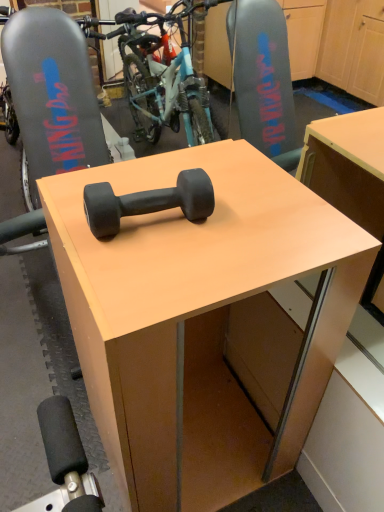
Measure the distance between point (201,176) and camera.

30.04 inches.

What is the approximate width of black rubber dumbbell at center?

black rubber dumbbell at center is 9.39 inches wide.

I want to click on black rubber dumbbell at center, so click(148, 202).

In order to face black rubber dumbbell at center, should I rotate leftwards or rightwards?

Turn left approximately 6.451 degrees to face it.

This screenshot has height=512, width=384. What do you see at coordinates (148, 202) in the screenshot?
I see `black rubber dumbbell at center` at bounding box center [148, 202].

Looking at this image, what is the approximate width of matte black dumbbell at center?

The width of matte black dumbbell at center is 52.52 centimeters.

You are a GUI agent. You are given a task and a screenshot of the screen. Output one action in this format:
    pyautogui.click(x=<x>, y=<y>)
    Task: Click on the matte black dumbbell at center
    The image size is (384, 512).
    Given the screenshot: What is the action you would take?
    pyautogui.click(x=198, y=319)

The height and width of the screenshot is (512, 384). Describe the element at coordinates (198, 319) in the screenshot. I see `matte black dumbbell at center` at that location.

You are a GUI agent. You are given a task and a screenshot of the screen. Output one action in this format:
    pyautogui.click(x=<x>, y=<y>)
    Task: Click on the black rubber dumbbell at center
    
    Given the screenshot: What is the action you would take?
    pyautogui.click(x=148, y=202)

Would you say black rubber dumbbell at center is to the left or to the right of matte black dumbbell at center in the picture?

black rubber dumbbell at center is positioned on matte black dumbbell at center's left side.

Which is behind, black rubber dumbbell at center or matte black dumbbell at center?

black rubber dumbbell at center is more distant.

Which is farther from the camera, (98, 192) or (203, 302)?

Positioned behind is point (98, 192).

From the image's perspective, is black rubber dumbbell at center located beneath matte black dumbbell at center?

Incorrect, from the image's perspective, black rubber dumbbell at center is higher than matte black dumbbell at center.

From a real-world perspective, relative to matte black dumbbell at center, is black rubber dumbbell at center vertically above or below?

black rubber dumbbell at center is situated higher than matte black dumbbell at center in the real world.

Considering the relative sizes of black rubber dumbbell at center and matte black dumbbell at center in the image provided, is black rubber dumbbell at center thinner than matte black dumbbell at center?

Indeed, black rubber dumbbell at center has a lesser width compared to matte black dumbbell at center.

Considering the sizes of objects black rubber dumbbell at center and matte black dumbbell at center in the image provided, who is shorter, black rubber dumbbell at center or matte black dumbbell at center?

With less height is black rubber dumbbell at center.

Based on the photo, is black rubber dumbbell at center smaller than matte black dumbbell at center?

Indeed, black rubber dumbbell at center has a smaller size compared to matte black dumbbell at center.

Would you say black rubber dumbbell at center is outside matte black dumbbell at center?

Yes.

Would you say black rubber dumbbell at center is a long distance from matte black dumbbell at center?

No.

Is black rubber dumbbell at center facing away from matte black dumbbell at center?

No.

How much distance is there between black rubber dumbbell at center and matte black dumbbell at center?

The distance of black rubber dumbbell at center from matte black dumbbell at center is 14.08 inches.

Locate an element on the screen. Image resolution: width=384 pixels, height=512 pixels. desk lying on the right of black rubber dumbbell at center is located at coordinates (198, 319).

Considering the positions of objects matte black dumbbell at center and black rubber dumbbell at center in the image provided, who is more to the left, matte black dumbbell at center or black rubber dumbbell at center?

black rubber dumbbell at center.

Between matte black dumbbell at center and black rubber dumbbell at center, which one is positioned behind?

black rubber dumbbell at center is further away from the camera.

Is point (217, 183) closer to camera compared to point (203, 182)?

No.

From the image's perspective, is matte black dumbbell at center beneath black rubber dumbbell at center?

Yes, from the image's perspective, matte black dumbbell at center is below black rubber dumbbell at center.

From a real-world perspective, is matte black dumbbell at center above or below black rubber dumbbell at center?

matte black dumbbell at center is situated lower than black rubber dumbbell at center in the real world.

Between matte black dumbbell at center and black rubber dumbbell at center, which one has smaller width?

Thinner between the two is black rubber dumbbell at center.

Consider the image. Considering the sizes of objects matte black dumbbell at center and black rubber dumbbell at center in the image provided, who is taller, matte black dumbbell at center or black rubber dumbbell at center?

With more height is matte black dumbbell at center.

Looking at the image, does matte black dumbbell at center seem bigger or smaller compared to black rubber dumbbell at center?

In the image, matte black dumbbell at center appears to be larger than black rubber dumbbell at center.

Would you say matte black dumbbell at center is inside or outside black rubber dumbbell at center?

The correct answer is: outside.

Are matte black dumbbell at center and black rubber dumbbell at center located far from each other?

matte black dumbbell at center is near black rubber dumbbell at center, not far away.

Could you tell me if matte black dumbbell at center is facing black rubber dumbbell at center?

No, matte black dumbbell at center is not aimed at black rubber dumbbell at center.

At what (x,y) coordinates should I click in order to perform the action: click on desk that is under the black rubber dumbbell at center (from a real-world perspective). Please return your answer as a coordinate pair (x, y). The height and width of the screenshot is (512, 384). Looking at the image, I should click on (198, 319).

I want to click on dumbbell to the left of matte black dumbbell at center, so click(148, 202).

Locate an element on the screen. dumbbell above the matte black dumbbell at center (from the image's perspective) is located at coordinates (148, 202).